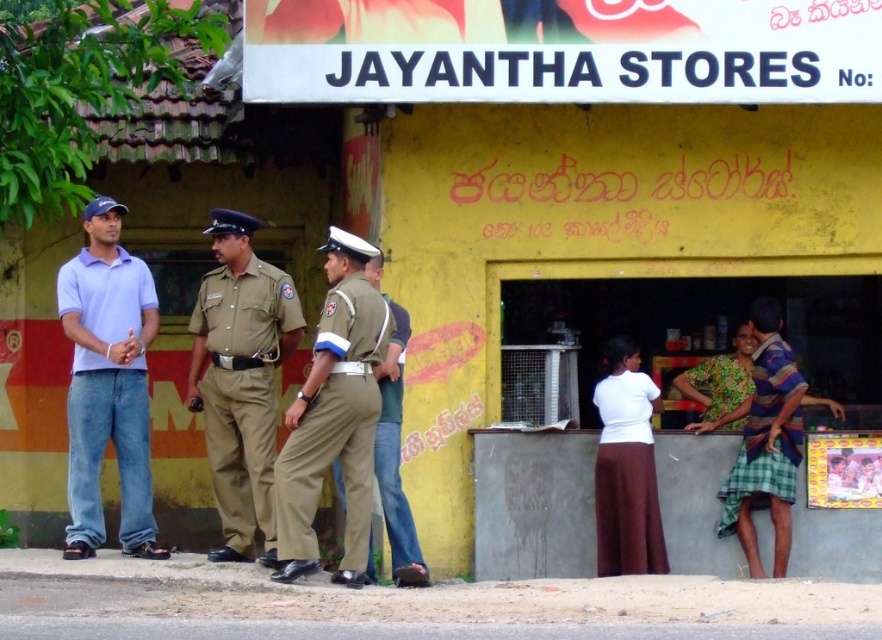
From the picture: Can you confirm if khaki fabric pants at center is wider than khaki fabric uniform at center?

Indeed, khaki fabric pants at center has a greater width compared to khaki fabric uniform at center.

Does point (278, 458) come closer to viewer compared to point (392, 316)?

Yes, point (278, 458) is in front of point (392, 316).

Where is `khaki fabric pants at center`? The width and height of the screenshot is (882, 640). khaki fabric pants at center is located at coordinates (334, 422).

Locate an element on the screen. khaki fabric pants at center is located at coordinates (334, 422).

The height and width of the screenshot is (640, 882). What do you see at coordinates (626, 477) in the screenshot?
I see `brown cotton skirt at lower center` at bounding box center [626, 477].

Between brown cotton skirt at lower center and floral fabric dress at lower right, which one has less height?

floral fabric dress at lower right

Who is more distant from viewer, (654, 528) or (716, 394)?

Positioned behind is point (716, 394).

At what (x,y) coordinates should I click in order to perform the action: click on brown cotton skirt at lower center. Please return your answer as a coordinate pair (x, y). The image size is (882, 640). Looking at the image, I should click on click(x=626, y=477).

Between light blue cotton shirt at left and brown cotton skirt at lower center, which one is positioned lower?

brown cotton skirt at lower center

Who is higher up, light blue cotton shirt at left or brown cotton skirt at lower center?

light blue cotton shirt at left

This screenshot has height=640, width=882. What do you see at coordinates (107, 384) in the screenshot?
I see `light blue cotton shirt at left` at bounding box center [107, 384].

The height and width of the screenshot is (640, 882). In order to click on light blue cotton shirt at left in this screenshot , I will do `click(107, 384)`.